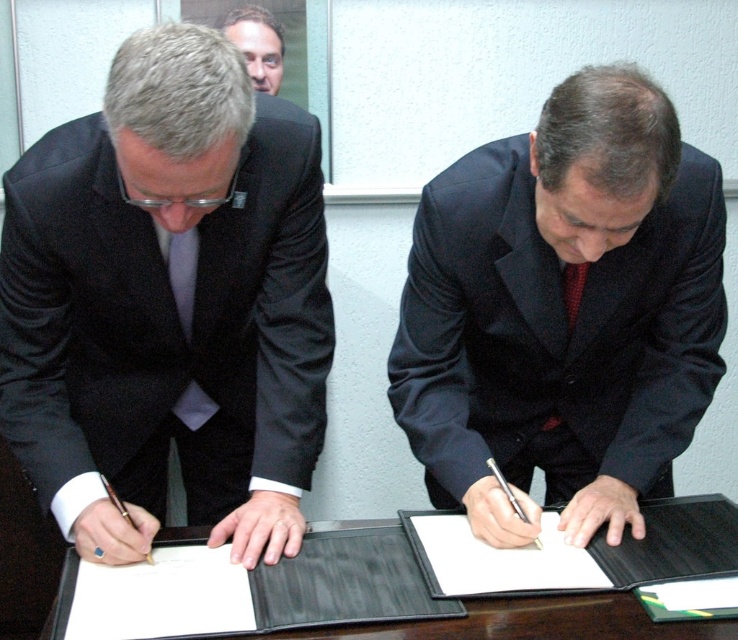
Is the position of dark blue suit at center less distant than that of red dotted tie at center?

Yes, it is.

Is point (435, 492) positioned behind point (572, 326)?

Yes, it is behind point (572, 326).

Locate an element on the screen. dark blue suit at center is located at coordinates (565, 310).

Where is `black leather table at center`? The height and width of the screenshot is (640, 738). black leather table at center is located at coordinates (455, 593).

At what (x,y) coordinates should I click in order to perform the action: click on black leather table at center. Please return your answer as a coordinate pair (x, y). The image size is (738, 640). Looking at the image, I should click on (455, 593).

Describe the element at coordinates (565, 310) in the screenshot. Image resolution: width=738 pixels, height=640 pixels. I see `dark blue suit at center` at that location.

Between dark blue suit at center and matte black suit at upper center, which one has more height?

With more height is dark blue suit at center.

Is point (482, 483) positioned behind point (241, 35)?

That is False.

Locate an element on the screen. dark blue suit at center is located at coordinates (565, 310).